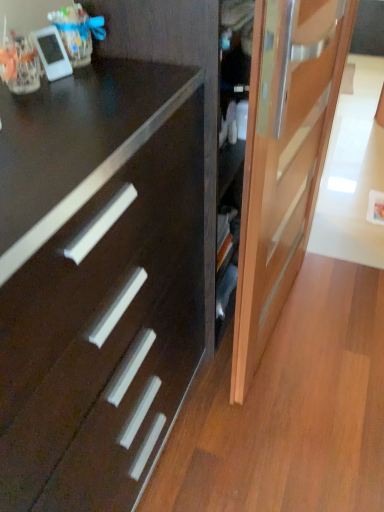
The width and height of the screenshot is (384, 512). What do you see at coordinates (112, 275) in the screenshot?
I see `dark wood drawer at center` at bounding box center [112, 275].

Find the location of a particular element. dark wood drawer at center is located at coordinates (112, 275).

What is the approximate width of dark wood drawer at center?

dark wood drawer at center is 20.35 inches in width.

What do you see at coordinates (283, 159) in the screenshot? The width and height of the screenshot is (384, 512). I see `light brown wooden door at right` at bounding box center [283, 159].

Locate an element on the screen. The height and width of the screenshot is (512, 384). light brown wooden door at right is located at coordinates (283, 159).

The height and width of the screenshot is (512, 384). Identify the location of dark wood drawer at center. [112, 275].

Consider the image. Is dark wood drawer at center at the left side of light brown wooden door at right?

Indeed, dark wood drawer at center is positioned on the left side of light brown wooden door at right.

Does dark wood drawer at center come behind light brown wooden door at right?

No, the depth of dark wood drawer at center is less than that of light brown wooden door at right.

Between point (127, 264) and point (261, 340), which one is positioned behind?

The point (261, 340) is behind.

In the scene shown: From the image's perspective, is dark wood drawer at center below light brown wooden door at right?

Indeed, from the image's perspective, dark wood drawer at center is shown beneath light brown wooden door at right.

From a real-world perspective, which is physically above, dark wood drawer at center or light brown wooden door at right?

In real-world perspective, light brown wooden door at right is above.

Is dark wood drawer at center thinner than light brown wooden door at right?

No, dark wood drawer at center is not thinner than light brown wooden door at right.

Based on the photo, can you confirm if dark wood drawer at center is taller than light brown wooden door at right?

Incorrect, the height of dark wood drawer at center is not larger of that of light brown wooden door at right.

In the scene shown: Can you confirm if dark wood drawer at center is bigger than light brown wooden door at right?

Yes, dark wood drawer at center is bigger than light brown wooden door at right.

Looking at this image, would you say dark wood drawer at center is inside or outside light brown wooden door at right?

dark wood drawer at center lies outside light brown wooden door at right.

Is dark wood drawer at center not close to light brown wooden door at right?

No.

Is dark wood drawer at center oriented away from light brown wooden door at right?

dark wood drawer at center does not have its back to light brown wooden door at right.

How many degrees apart are the facing directions of dark wood drawer at center and light brown wooden door at right?

The facing directions of dark wood drawer at center and light brown wooden door at right are 4.38 degrees apart.

This screenshot has width=384, height=512. I want to click on door above the dark wood drawer at center (from the image's perspective), so click(283, 159).

Is light brown wooden door at right to the left of dark wood drawer at center from the viewer's perspective?

No.

Is light brown wooden door at right in front of or behind dark wood drawer at center in the image?

Visually, light brown wooden door at right is located behind dark wood drawer at center.

Considering the positions of point (352, 29) and point (203, 272), is point (352, 29) closer or farther from the camera than point (203, 272)?

Point (352, 29).

From the image's perspective, is light brown wooden door at right located above or below dark wood drawer at center?

From the image's perspective, light brown wooden door at right appears above dark wood drawer at center.

From a real-world perspective, which object stands above the other?

light brown wooden door at right is physically above.

Between light brown wooden door at right and dark wood drawer at center, which one has smaller width?

light brown wooden door at right is thinner.

Considering the relative sizes of light brown wooden door at right and dark wood drawer at center in the image provided, is light brown wooden door at right taller than dark wood drawer at center?

Correct, light brown wooden door at right is much taller as dark wood drawer at center.

Which of these two, light brown wooden door at right or dark wood drawer at center, is bigger?

With larger size is dark wood drawer at center.

Is dark wood drawer at center completely or partially inside light brown wooden door at right?

No, dark wood drawer at center is not a part of light brown wooden door at right.

Are light brown wooden door at right and dark wood drawer at center located far from each other?

Actually, light brown wooden door at right and dark wood drawer at center are a little close together.

Is light brown wooden door at right facing towards dark wood drawer at center?

No, light brown wooden door at right is not turned towards dark wood drawer at center.

Based on the photo, how different are the orientations of light brown wooden door at right and dark wood drawer at center in degrees?

4.38 degrees separate the facing orientations of light brown wooden door at right and dark wood drawer at center.

Where is `drawer located on the left of light brown wooden door at right`? This screenshot has height=512, width=384. drawer located on the left of light brown wooden door at right is located at coordinates (112, 275).

I want to click on door behind the dark wood drawer at center, so click(283, 159).

Identify the location of door on the right of dark wood drawer at center. (283, 159).